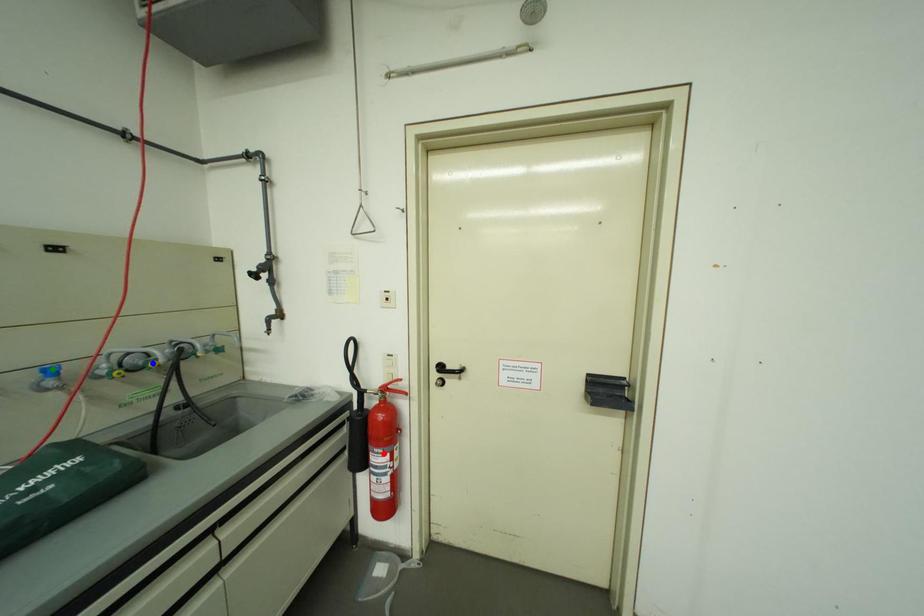
Order these from nearest to farthest:
red point
blue point
green point

green point
blue point
red point